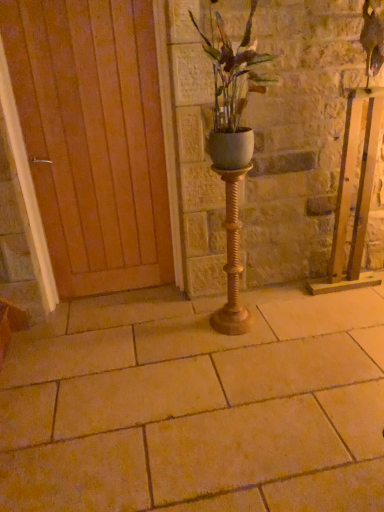
Question: Considering the positions of point (127, 202) and point (220, 76), is point (127, 202) closer or farther from the camera than point (220, 76)?

Choices:
 (A) farther
 (B) closer

Answer: (A)

Question: Considering the relative positions of wooden at left and white matte pot at center in the image provided, is wooden at left to the left or to the right of white matte pot at center?

Choices:
 (A) left
 (B) right

Answer: (A)

Question: Which of these objects is positioned closest to the wooden at left?

Choices:
 (A) gold textured candle holder at center
 (B) white matte pot at center
 (C) beige stone pavement at center

Answer: (B)

Question: Estimate the real-world distances between objects in this image. Which object is closer to the wooden at left?

Choices:
 (A) gold textured candle holder at center
 (B) beige stone pavement at center
 (C) white matte pot at center

Answer: (C)